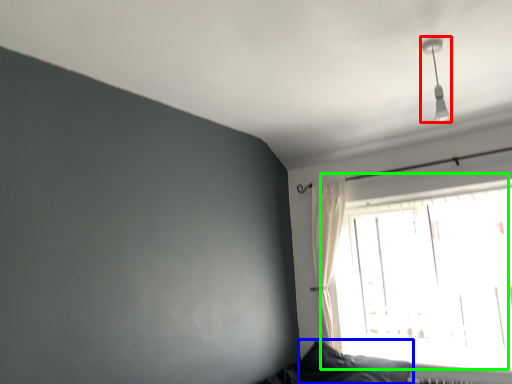
Question: Which is nearer to the fixture (highlighted by a red box)? pillow (highlighted by a blue box) or window (highlighted by a green box).

Choices:
 (A) pillow
 (B) window

Answer: (B)